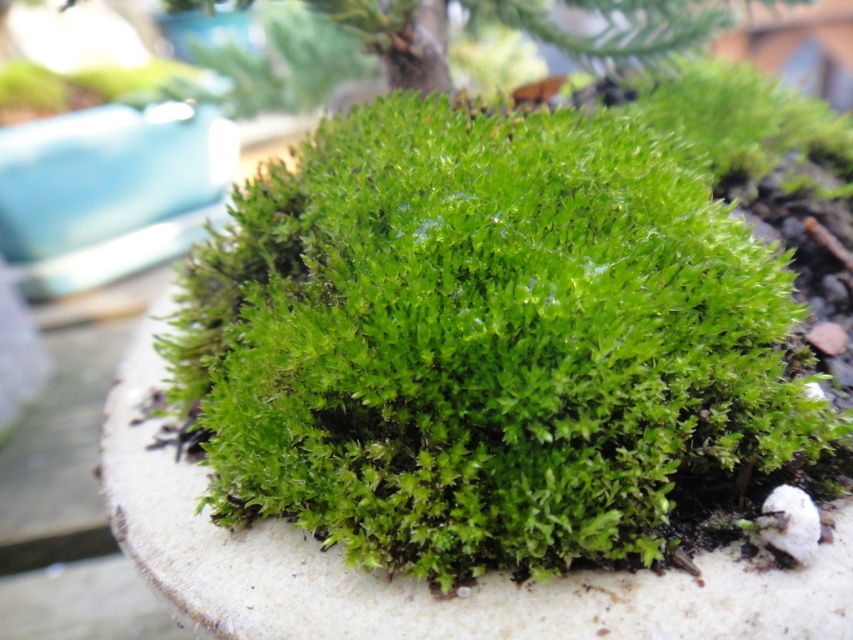
Question: Which of the following is the closest to the observer?

Choices:
 (A) (618, 445)
 (B) (469, 6)

Answer: (A)

Question: Does green fuzzy moss at center appear on the right side of green leafy tree at upper center?

Choices:
 (A) yes
 (B) no

Answer: (B)

Question: Does green fuzzy moss at center have a smaller size compared to green leafy tree at upper center?

Choices:
 (A) yes
 (B) no

Answer: (B)

Question: Does green fuzzy moss at center have a greater width compared to green leafy tree at upper center?

Choices:
 (A) no
 (B) yes

Answer: (A)

Question: Among these points, which one is farthest from the camera?

Choices:
 (A) [x=606, y=56]
 (B) [x=718, y=308]

Answer: (A)